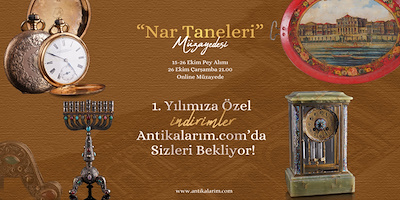
Identify the location of menorah. (86, 121).